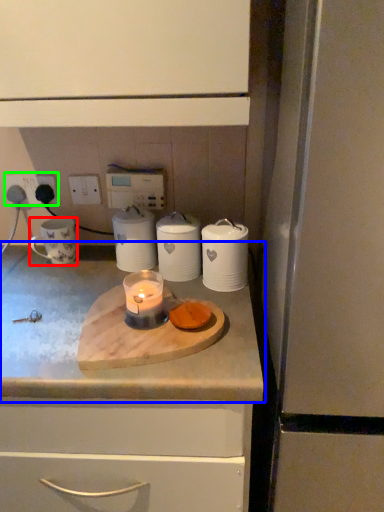
Question: Estimate the real-world distances between objects in this image. Which object is closer to mug (highlighted by a red box), countertop (highlighted by a blue box) or electric outlet (highlighted by a green box)?

Choices:
 (A) countertop
 (B) electric outlet

Answer: (B)